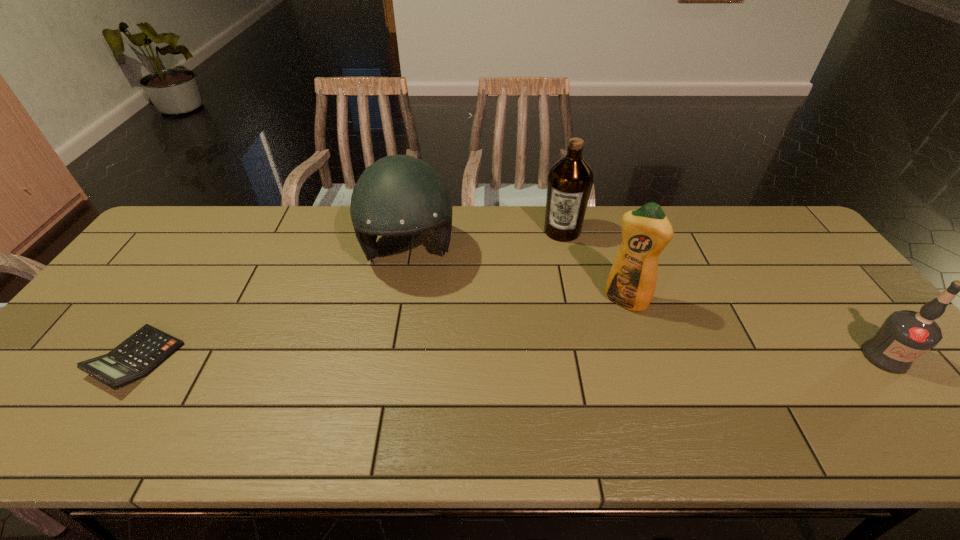
Where is `calculator`? calculator is located at coordinates (136, 357).

Find the location of `the shortest object`. the shortest object is located at coordinates (136, 357).

In order to click on vodka in this screenshot , I will do `click(905, 335)`.

Where is `the rightmost object`? The width and height of the screenshot is (960, 540). the rightmost object is located at coordinates (905, 335).

The height and width of the screenshot is (540, 960). What are the coordinates of `the fourth object from left to right` in the screenshot? It's located at (646, 231).

At what (x,y) coordinates should I click in order to perform the action: click on olive oil. Please return your answer as a coordinate pair (x, y). Looking at the image, I should click on (570, 180).

You are a GUI agent. You are given a task and a screenshot of the screen. Output one action in this format:
    pyautogui.click(x=<x>, y=<y>)
    Task: Click on the football helmet
    This screenshot has height=540, width=960.
    Given the screenshot: What is the action you would take?
    pyautogui.click(x=398, y=195)

Where is `free space located on the right of the leftmost object`? The image size is (960, 540). free space located on the right of the leftmost object is located at coordinates pos(221,359).

Find the location of a particular element. The image size is (960, 540). blank space located on the label of the detergent is located at coordinates click(597, 344).

Find the location of a particular element. The image size is (960, 540). free space located 0.140m on the label of the detergent is located at coordinates (595, 347).